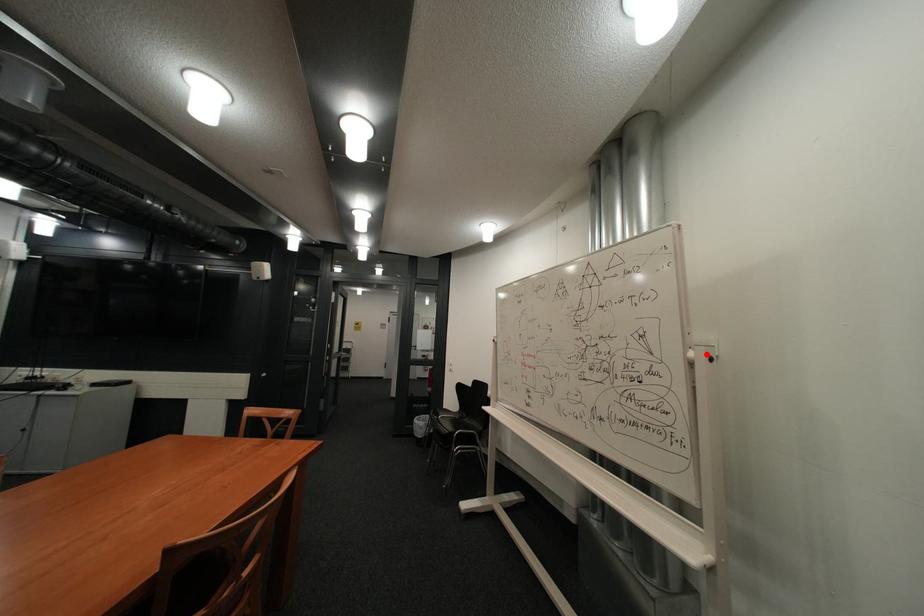
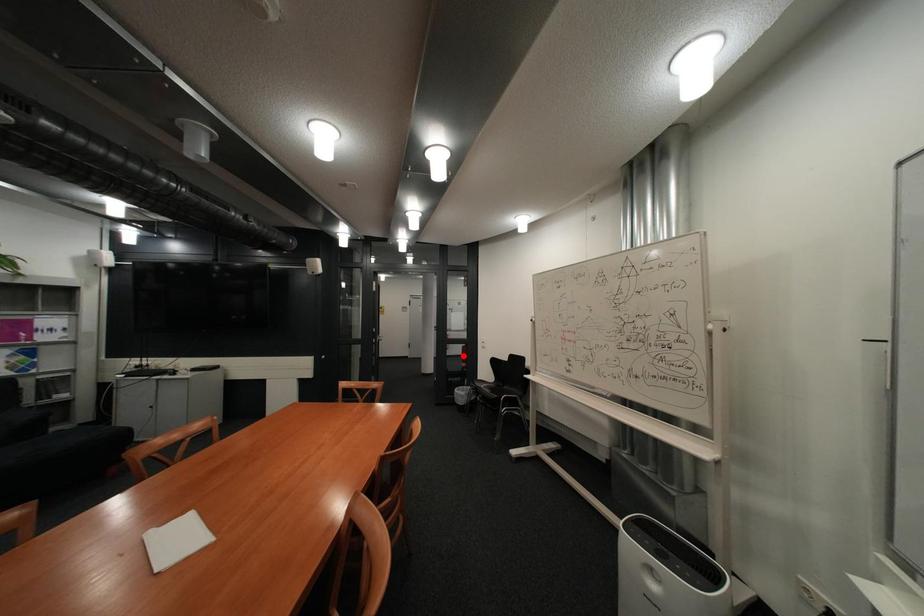
From the picture: I am providing you with two images of the same scene from different viewpoints. A red point is marked on the first image and another point is marked on the second image. Is the red point in image1 aligned with the point shown in image2?

No